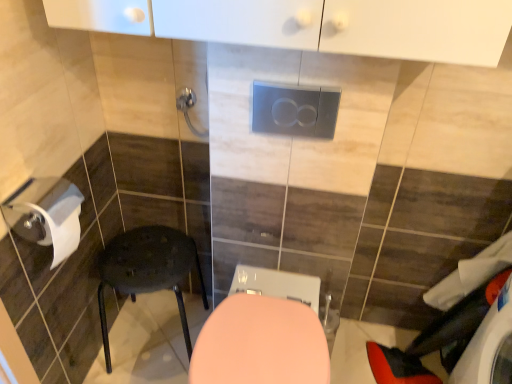
Question: Do you think satin silver flush plate at center is within white fabric laundry at lower right, or outside of it?

Choices:
 (A) outside
 (B) inside

Answer: (A)

Question: Based on their sizes in the image, would you say satin silver flush plate at center is bigger or smaller than white fabric laundry at lower right?

Choices:
 (A) small
 (B) big

Answer: (A)

Question: Which object is the farthest from the pink glossy toilet at center?

Choices:
 (A) matte black stool at lower left
 (B) white fabric laundry at lower right
 (C) metallic silver towel bar at upper center
 (D) satin silver flush plate at center

Answer: (B)

Question: Estimate the real-world distances between objects in this image. Which object is closer to the metallic silver towel bar at upper center?

Choices:
 (A) satin silver flush plate at center
 (B) matte black stool at lower left
 (C) white fabric laundry at lower right
 (D) pink glossy toilet at center

Answer: (A)